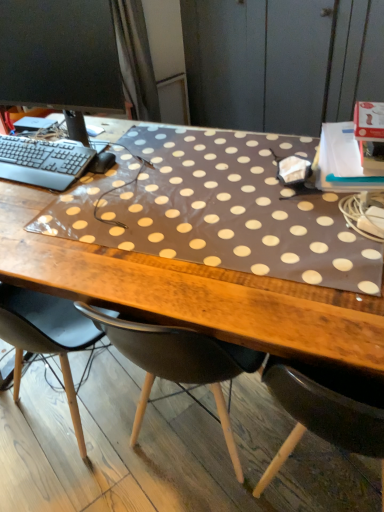
Where is `free space to the left of black matte mouse at center`? This screenshot has width=384, height=512. free space to the left of black matte mouse at center is located at coordinates (34, 185).